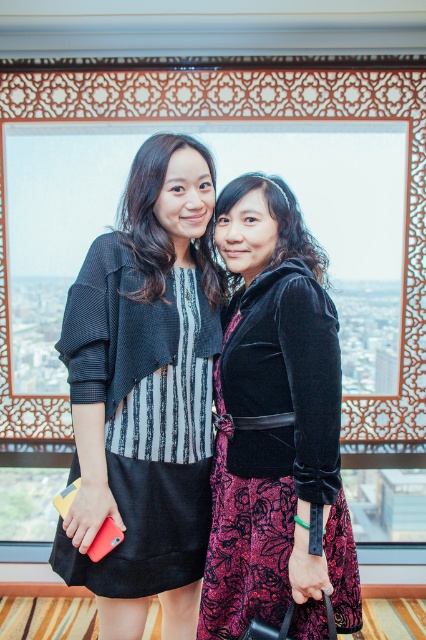
You are taking a photo of the two people in the scene. The first person is at point (293, 273) and the second person is at point (112, 392). Which person will appear larger in the photo?

The person at point (293, 273) will appear larger in the photo because they are closer to the camera than the person at point (112, 392).